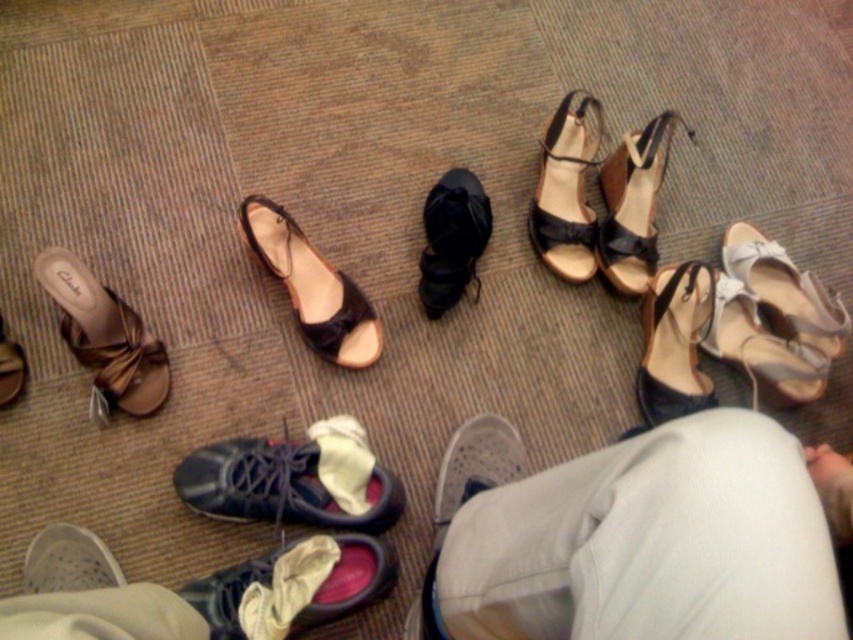
Can you confirm if white leather sandals at upper right is taller than black leather sandal at lower right?

Incorrect, white leather sandals at upper right's height is not larger of black leather sandal at lower right's.

Image resolution: width=853 pixels, height=640 pixels. What are the coordinates of `white leather sandals at upper right` in the screenshot? It's located at (724, 337).

Between point (567, 136) and point (3, 404), which one is positioned behind?

The point (567, 136) is behind.

Does black leather sandals at upper center lie behind matte brown sandal at upper left?

Yes, it is behind matte brown sandal at upper left.

Locate an element on the screen. The image size is (853, 640). black leather sandals at upper center is located at coordinates (566, 189).

Find the location of a particular element. black leather sandals at upper center is located at coordinates (566, 189).

Is point (343, 474) behind point (10, 362)?

That is False.

Does dark blue leather shoe at center have a smaller size compared to matte brown sandal at upper left?

No.

Between point (300, 484) and point (4, 364), which one is positioned in front?

Point (300, 484) is more forward.

Image resolution: width=853 pixels, height=640 pixels. In order to click on dark blue leather shoe at center in this screenshot , I will do `click(293, 480)`.